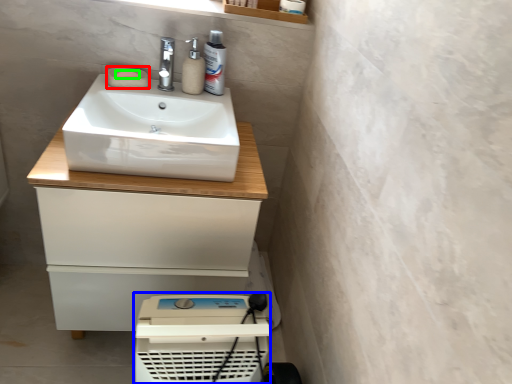
Question: Which object is positioned closest to soap (highlighted by a red box)? Select from appliance (highlighted by a blue box) and soap (highlighted by a green box).

Choices:
 (A) appliance
 (B) soap

Answer: (B)